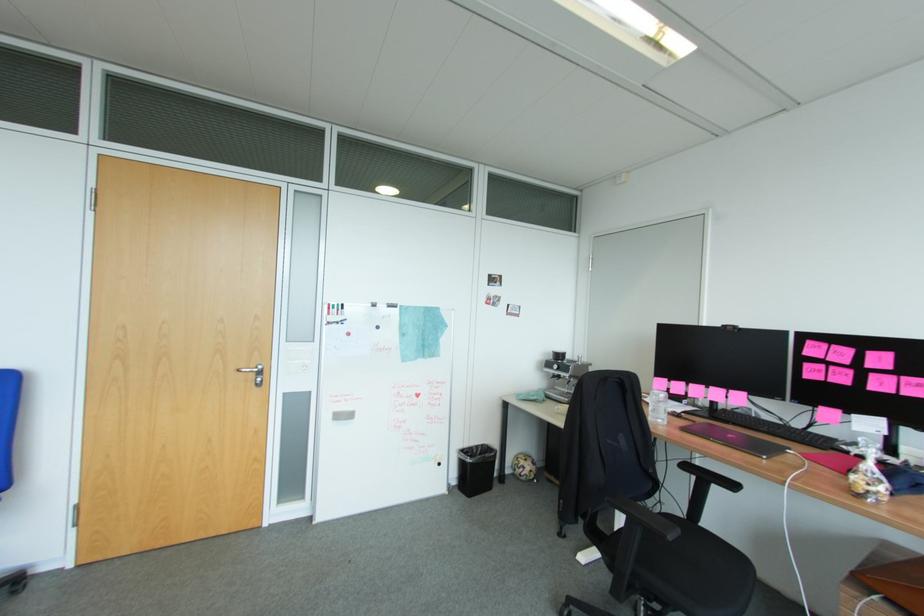
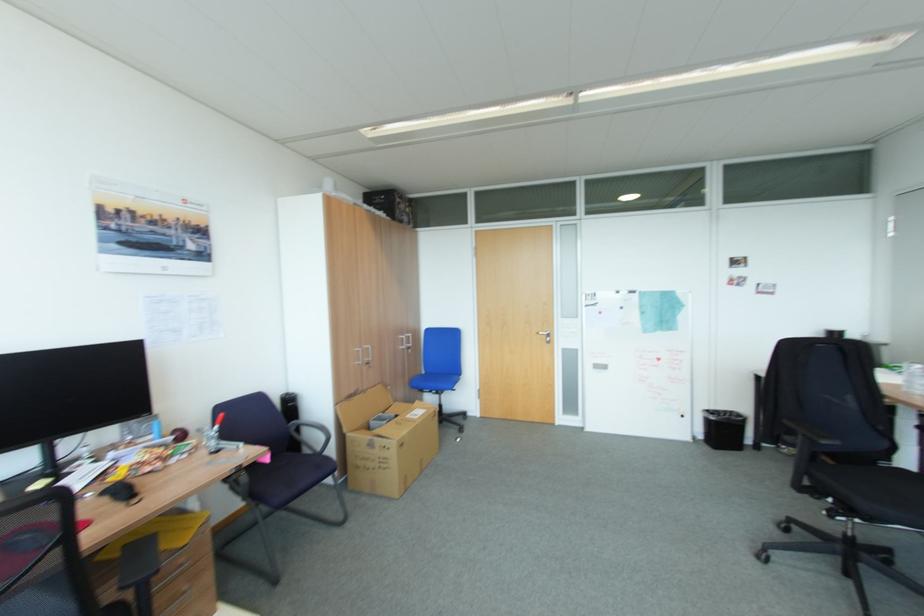
Where in the second image is the point corresponding to pixel 488 445 from the first image?

(736, 411)